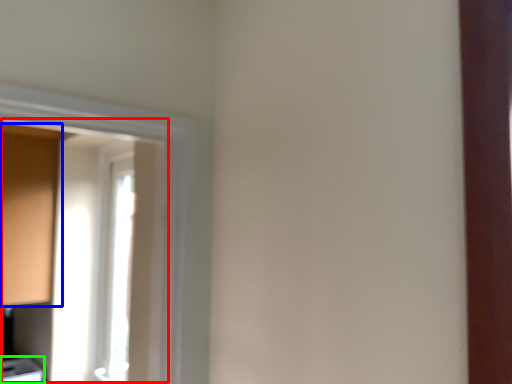
Question: Based on their relative distances, which object is nearer to window screen (highlighted by a red box)? Choose from cabinetry (highlighted by a blue box) and cabinetry (highlighted by a green box).

Choices:
 (A) cabinetry
 (B) cabinetry

Answer: (A)